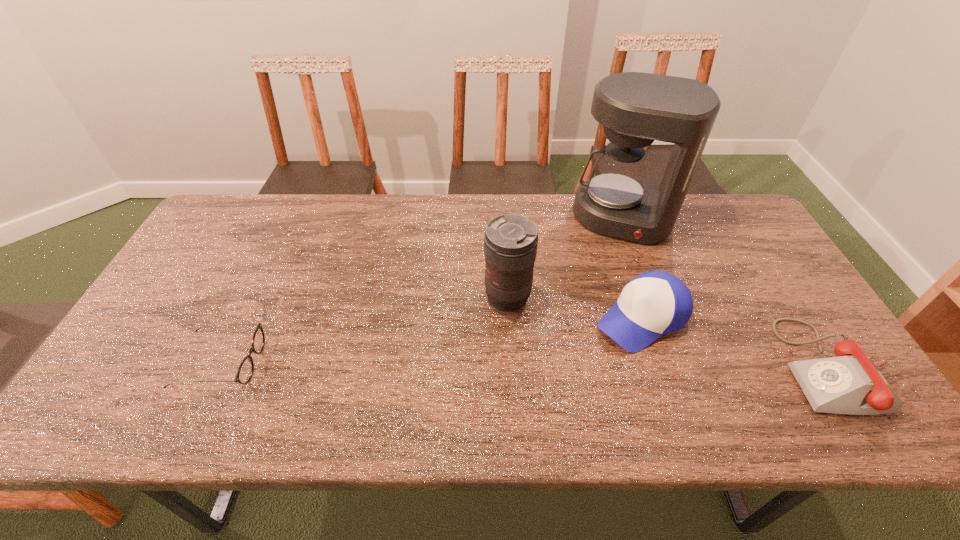
What are the coordinates of `the shortest object` in the screenshot? It's located at (244, 374).

The image size is (960, 540). In order to click on spectacles in this screenshot , I will do `click(244, 374)`.

Image resolution: width=960 pixels, height=540 pixels. Identify the location of the fourth tallest object. (850, 383).

Find the location of a particular element. This screenshot has width=960, height=540. the rightmost object is located at coordinates (850, 383).

Find the location of a particular element. The image size is (960, 540). telephoto lens is located at coordinates (510, 241).

The image size is (960, 540). Find the location of `the fourth object from right to left`. the fourth object from right to left is located at coordinates (510, 241).

This screenshot has height=540, width=960. I want to click on coffee maker, so click(x=635, y=108).

I want to click on the farthest object, so click(635, 108).

Locate an element on the screen. baseball cap is located at coordinates (655, 303).

This screenshot has height=540, width=960. Identify the location of vacant space situated 0.350m through the lenses of the spectacles. (404, 362).